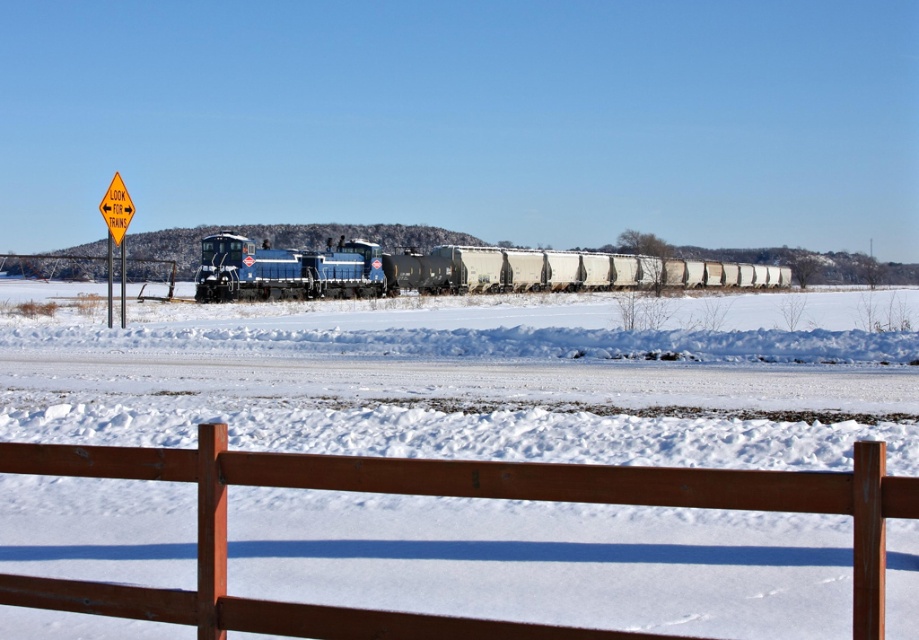
Question: Considering the relative positions of brown wooden fence at lower center and blue matte train at center in the image provided, where is brown wooden fence at lower center located with respect to blue matte train at center?

Choices:
 (A) above
 (B) below

Answer: (B)

Question: In this image, where is brown wooden fence at lower center located relative to blue matte train at center?

Choices:
 (A) below
 (B) above

Answer: (A)

Question: Which of the following is the farthest from the observer?

Choices:
 (A) (548, 253)
 (B) (328, 468)

Answer: (A)

Question: Which point is closer to the camera taking this photo?

Choices:
 (A) (514, 484)
 (B) (320, 268)

Answer: (A)

Question: Does brown wooden fence at lower center lie in front of blue matte train at center?

Choices:
 (A) no
 (B) yes

Answer: (B)